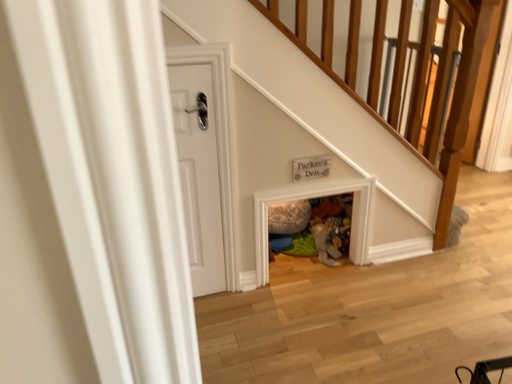
Image resolution: width=512 pixels, height=384 pixels. I want to click on free space in front of white glossy door at center, so click(217, 318).